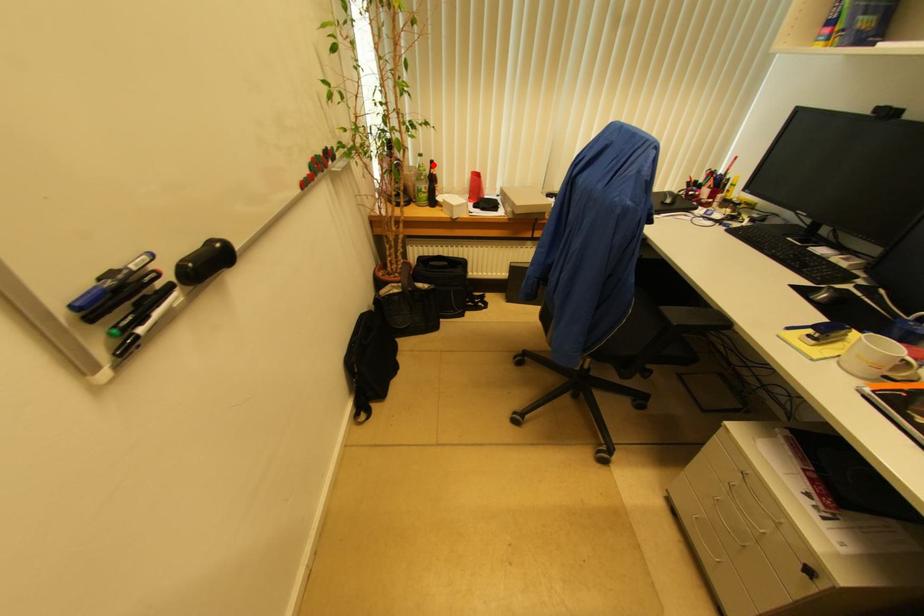
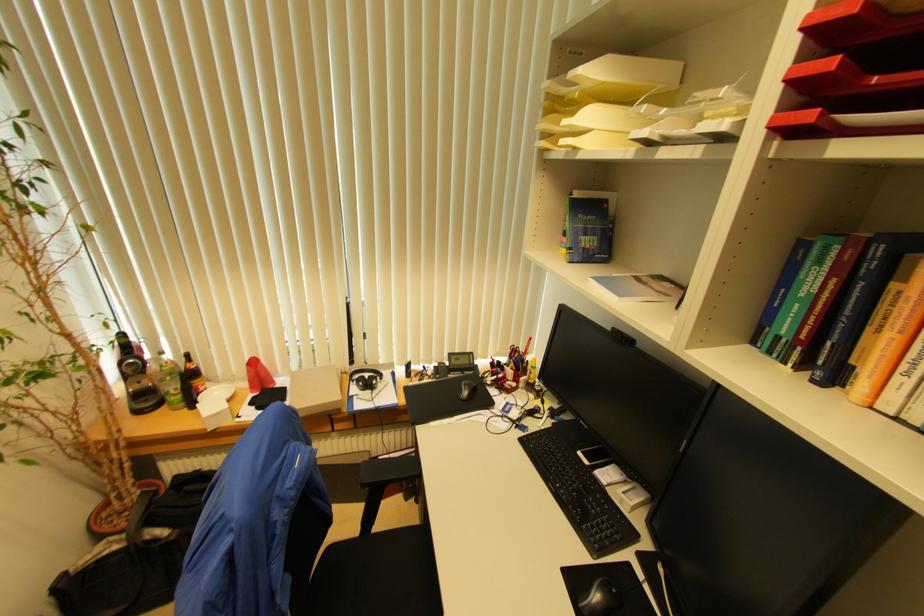
The point at the highlighted location is marked in the first image. Where is the corresponding point in the second image?

(188, 358)